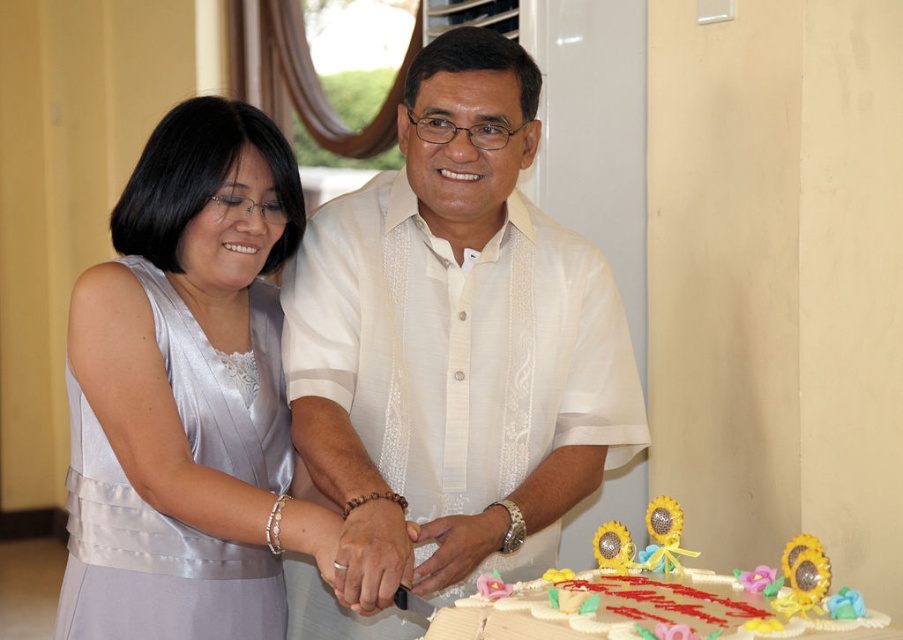
You are a photographer at a birthday party and need to capture a closeup shot of the white fondant cake at lower center without including the satin dress at left in the frame. Given that the camera has a focal length of 50mm and the minimum focusing distance is 2 feet, can you position yourself appropriately to achieve this?

The satin dress at left is 22.89 inches away from the white fondant cake at lower center. Since 22.89 inches is approximately 1.9 feet, which is less than the camera minimum focusing distance of 2 feet, you cannot focus on the cake without the dress being in the frame.